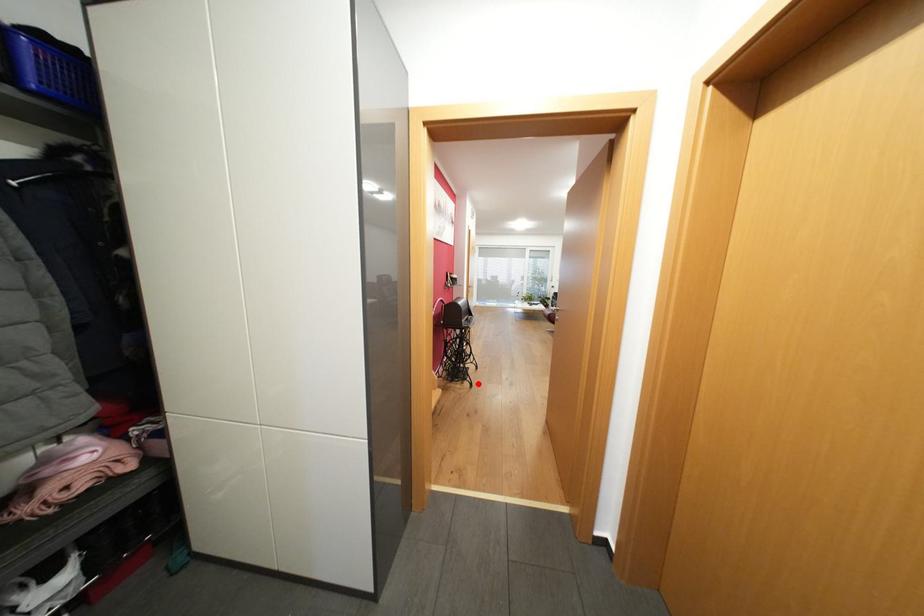
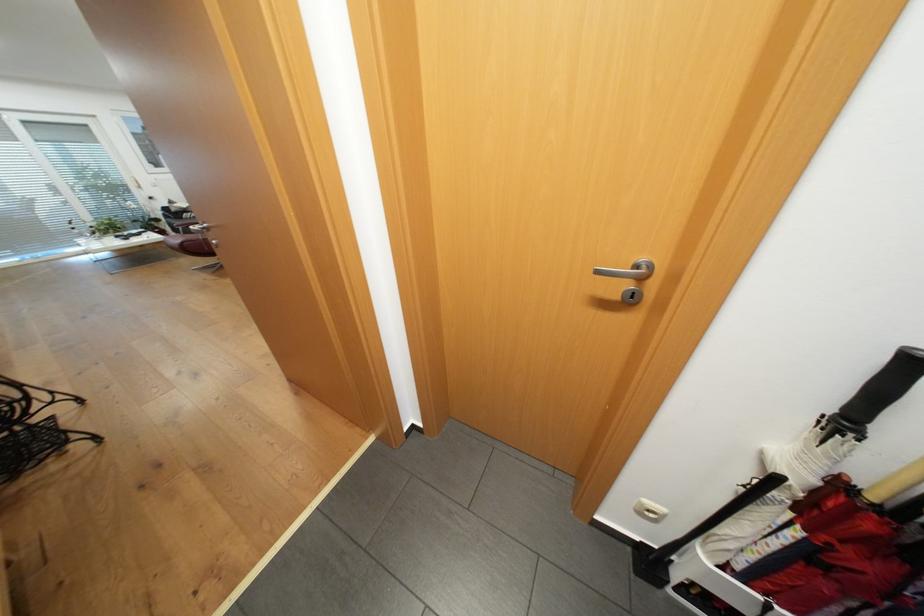
The point at the highlighted location is marked in the first image. Where is the corresponding point in the second image?

(102, 438)